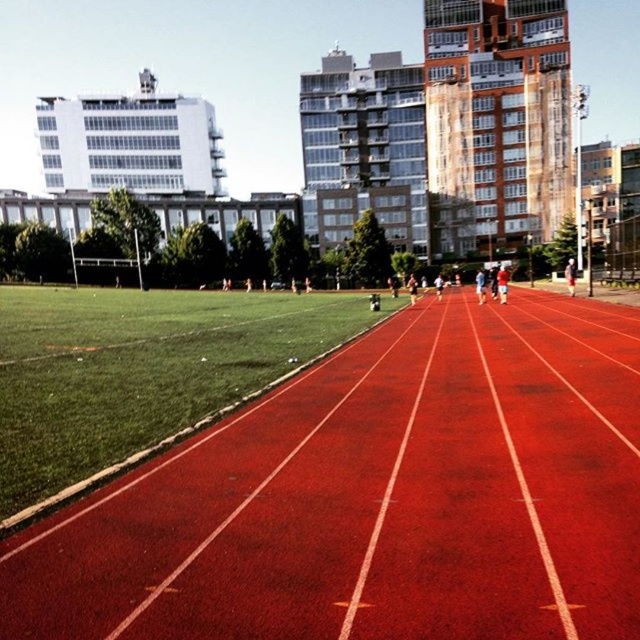
You are a photographer standing at the edge of the rubberized red track at center and the red fabric shorts at center. You want to capture both objects in a single frame. Which object should you zoom in on to ensure both are visible?

The rubberized red track at center is shorter than the red fabric shorts at center, so you should zoom in on the red fabric shorts at center to ensure both are visible.

You are a photographer standing at the edge of the running track. You want to take a photo of the red fabric shorts at center and the smooth white shirt at center. Which object should you zoom in on to capture more details of the smaller one?

The red fabric shorts at center has a smaller size compared to the smooth white shirt at center, so you should zoom in on the red fabric shorts at center to capture more details of the smaller one.